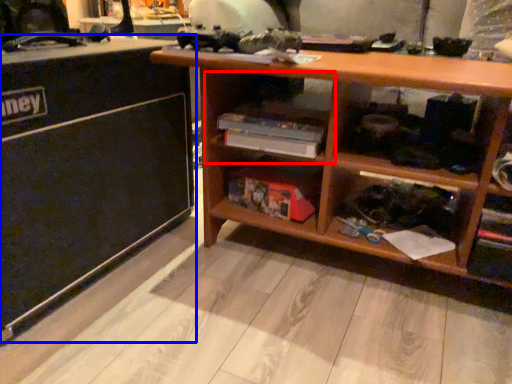
Question: Which object appears closest to the camera in this image, cabinet (highlighted by a red box) or table (highlighted by a blue box)?

Choices:
 (A) cabinet
 (B) table

Answer: (B)